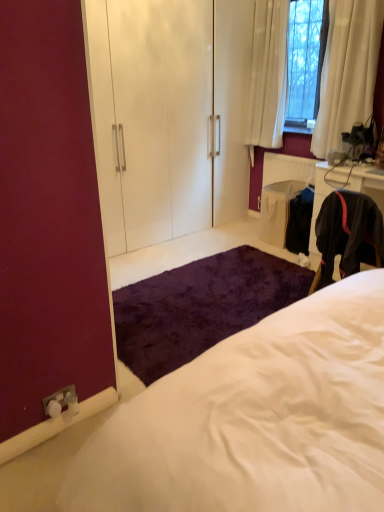
Locate an element on the screen. empty space that is ontop of white textured radiator at right (from a real-world perspective) is located at coordinates (293, 155).